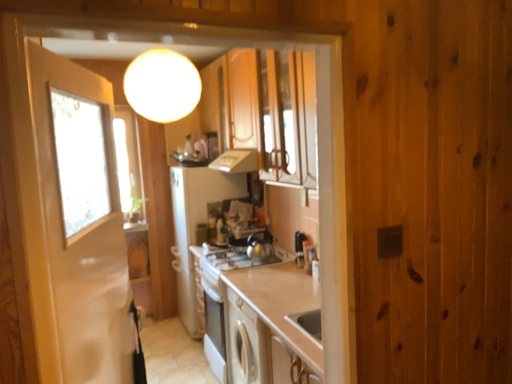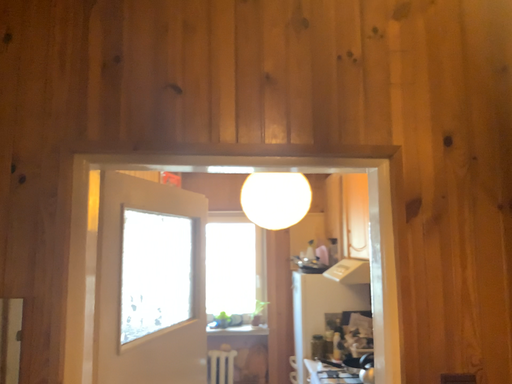
Question: Which way did the camera rotate in the video?

Choices:
 (A) rotated upward
 (B) rotated downward

Answer: (A)